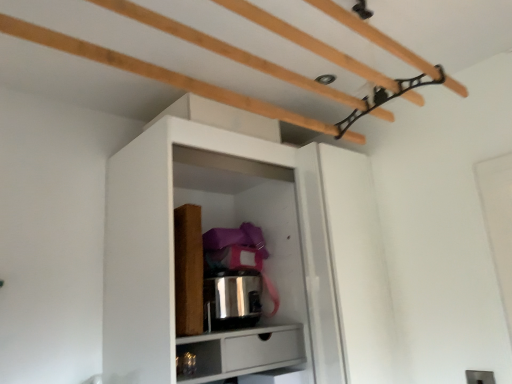
I want to click on white matte drawer at lower center, so click(242, 351).

Image resolution: width=512 pixels, height=384 pixels. Describe the element at coordinates (242, 351) in the screenshot. I see `white matte drawer at lower center` at that location.

Image resolution: width=512 pixels, height=384 pixels. Find the location of `white matte drawer at lower center`. white matte drawer at lower center is located at coordinates (242, 351).